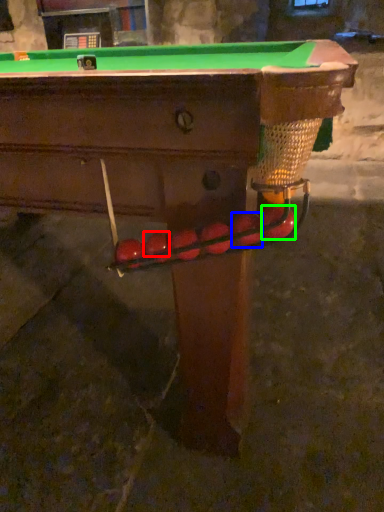
Question: Which object is positioned farthest from fruit (highlighted by a red box)? Select from fruit (highlighted by a blue box) and fruit (highlighted by a green box).

Choices:
 (A) fruit
 (B) fruit

Answer: (B)